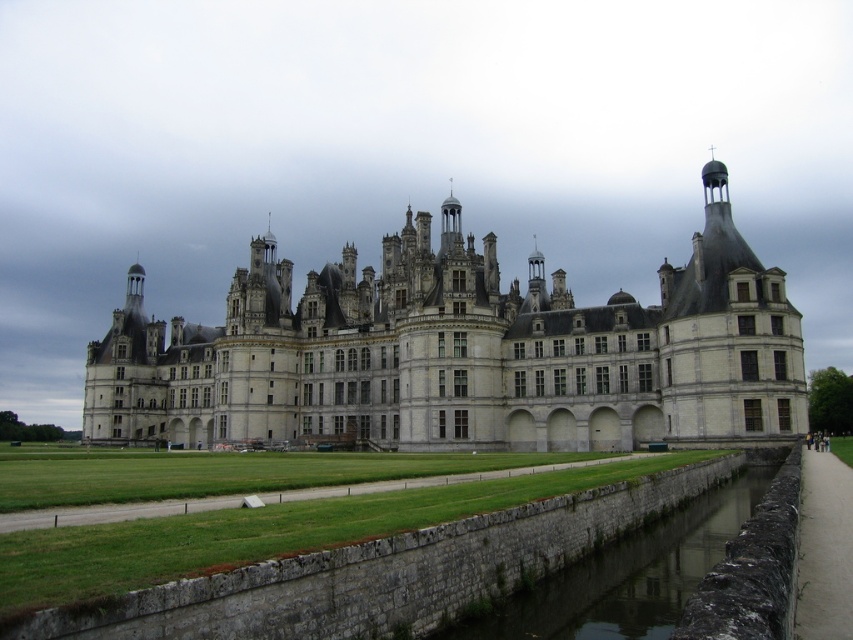
Question: Does gray stone castle at center appear under gray stone wall at lower center?

Choices:
 (A) yes
 (B) no

Answer: (B)

Question: Is the position of gray stone castle at center less distant than that of gray stone wall at lower center?

Choices:
 (A) no
 (B) yes

Answer: (A)

Question: Among these points, which one is nearest to the camera?

Choices:
 (A) (416, 298)
 (B) (766, 474)

Answer: (B)

Question: Can you confirm if gray stone castle at center is positioned to the left of gray stone wall at lower center?

Choices:
 (A) no
 (B) yes

Answer: (B)